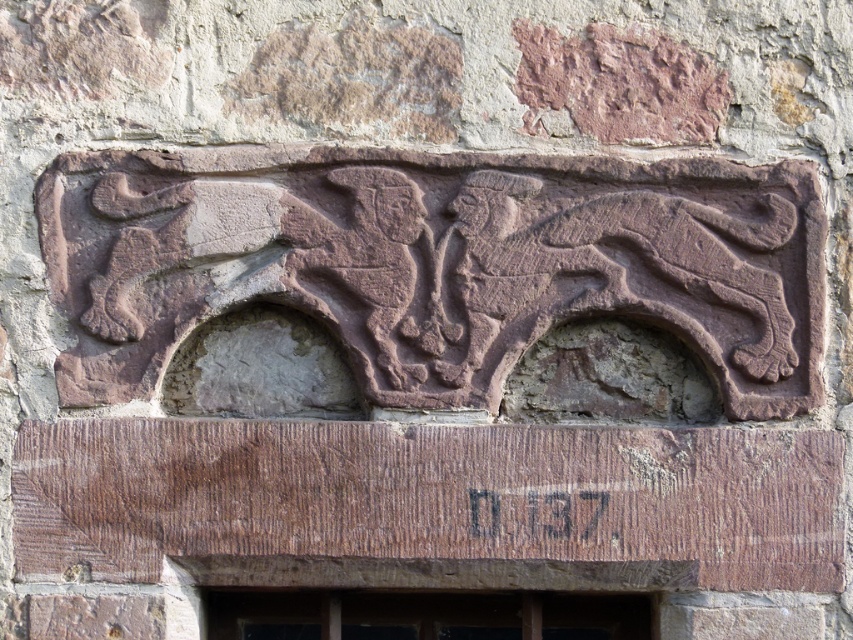
Question: Among these objects, which one is farthest from the camera?

Choices:
 (A) brown stone plaque at center
 (B) transparent glass window at lower center

Answer: (B)

Question: Is rustic stone carving at center above transparent glass window at lower center?

Choices:
 (A) no
 (B) yes

Answer: (B)

Question: Does rustic stone carving at center have a smaller size compared to brown stone plaque at center?

Choices:
 (A) yes
 (B) no

Answer: (B)

Question: Is rustic stone carving at center below transparent glass window at lower center?

Choices:
 (A) no
 (B) yes

Answer: (A)

Question: Which object is the farthest from the rustic stone carving at center?

Choices:
 (A) transparent glass window at lower center
 (B) brown stone plaque at center

Answer: (A)

Question: Which point is farther to the camera?

Choices:
 (A) transparent glass window at lower center
 (B) rustic stone carving at center
 (C) brown stone plaque at center

Answer: (A)